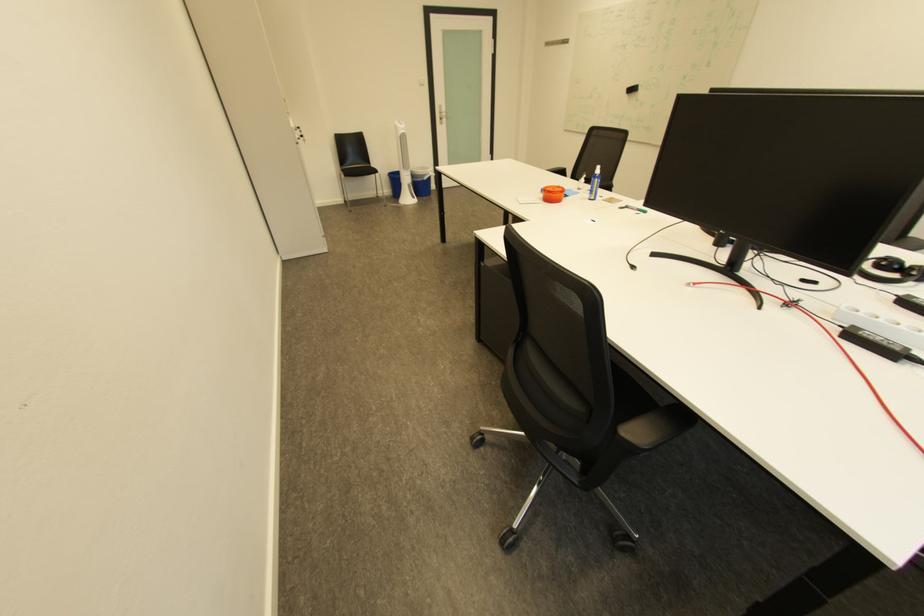
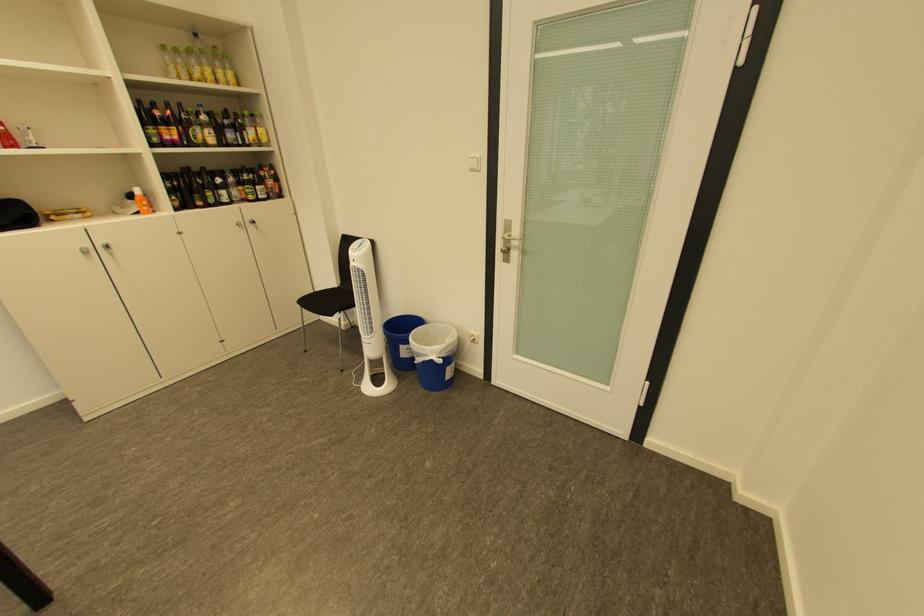
Find the pixel in the second image that matches [434,177] in the first image.

(429, 355)